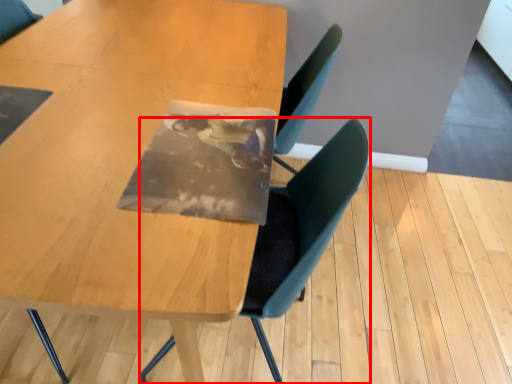
Question: From the image's perspective, what is the correct spatial positioning of chair (annotated by the red box) in reference to table?

Choices:
 (A) above
 (B) below

Answer: (B)